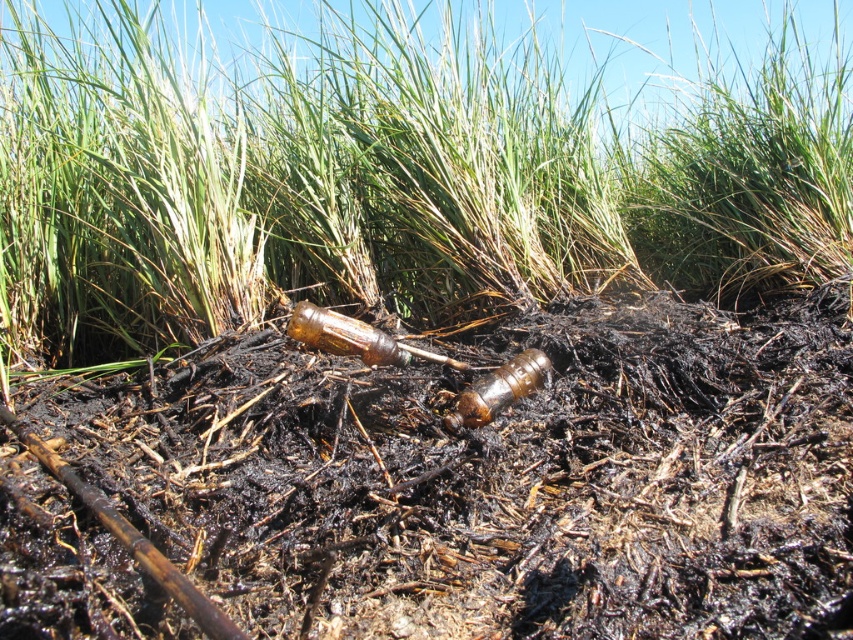
Question: Is brown charred dirt at center wider than green grass at center?

Choices:
 (A) yes
 (B) no

Answer: (A)

Question: Is brown charred dirt at center to the right of green grass at center from the viewer's perspective?

Choices:
 (A) yes
 (B) no

Answer: (A)

Question: Is brown charred dirt at center above green grass at center?

Choices:
 (A) yes
 (B) no

Answer: (B)

Question: Which of the following is the farthest from the observer?

Choices:
 (A) (308, 179)
 (B) (714, 515)

Answer: (A)